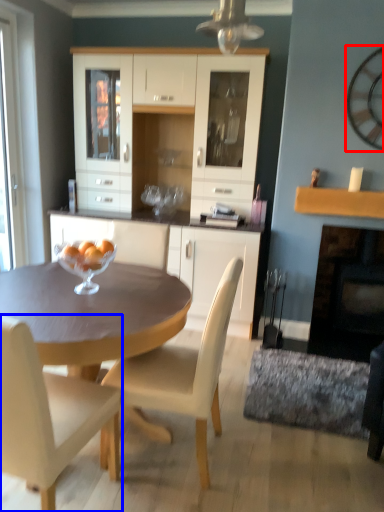
Question: Which of the following is the closest to the observer, clock (highlighted by a red box) or chair (highlighted by a blue box)?

Choices:
 (A) clock
 (B) chair

Answer: (B)